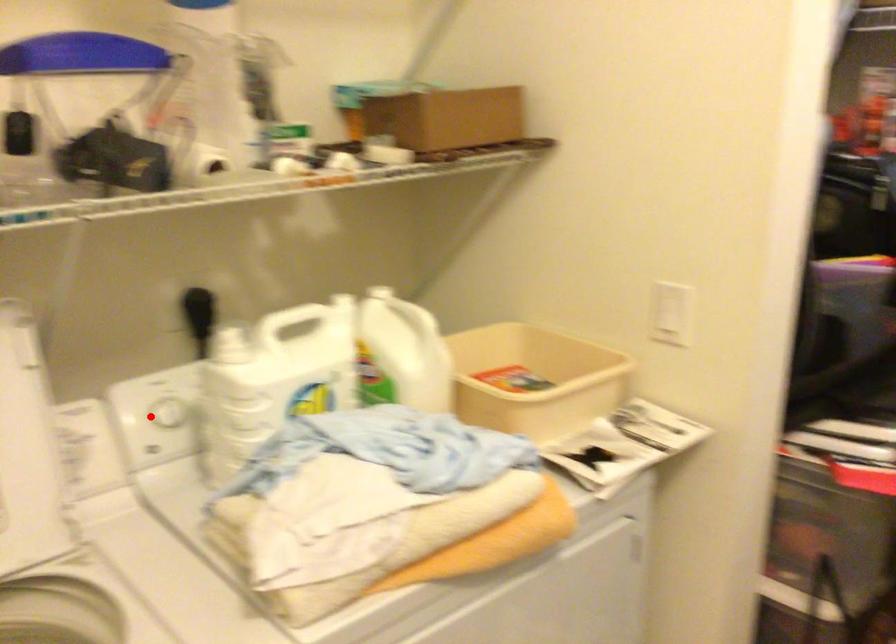
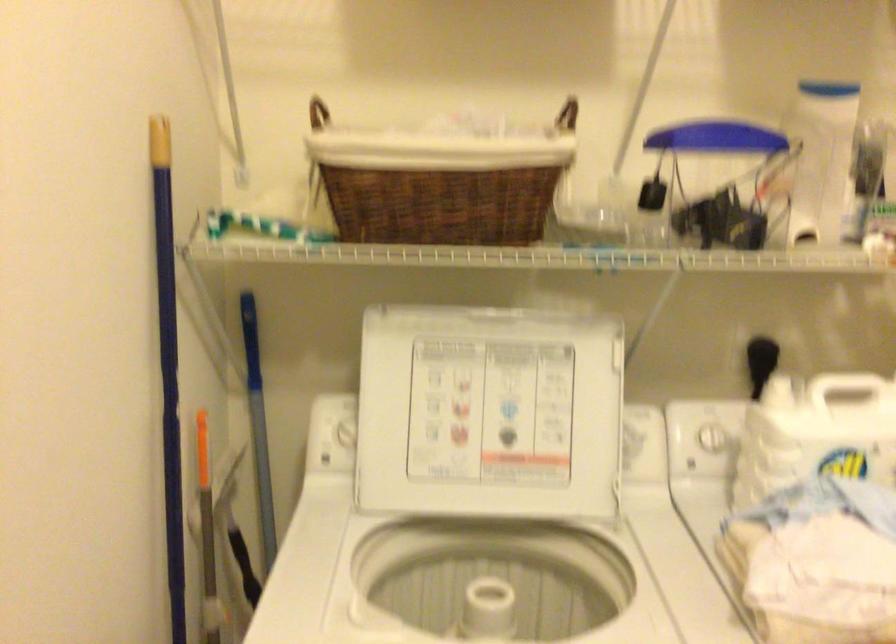
Question: I am providing you with two images of the same scene from different viewpoints. Given a red point in image1, look at the same physical point in image2. Is it:

Choices:
 (A) Closer to the viewpoint
 (B) Farther from the viewpoint

Answer: (B)